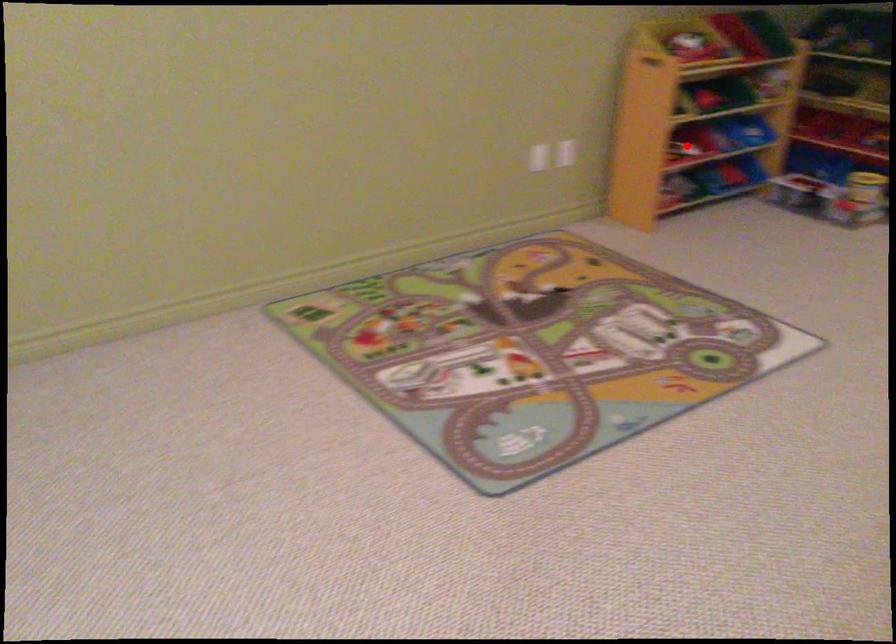
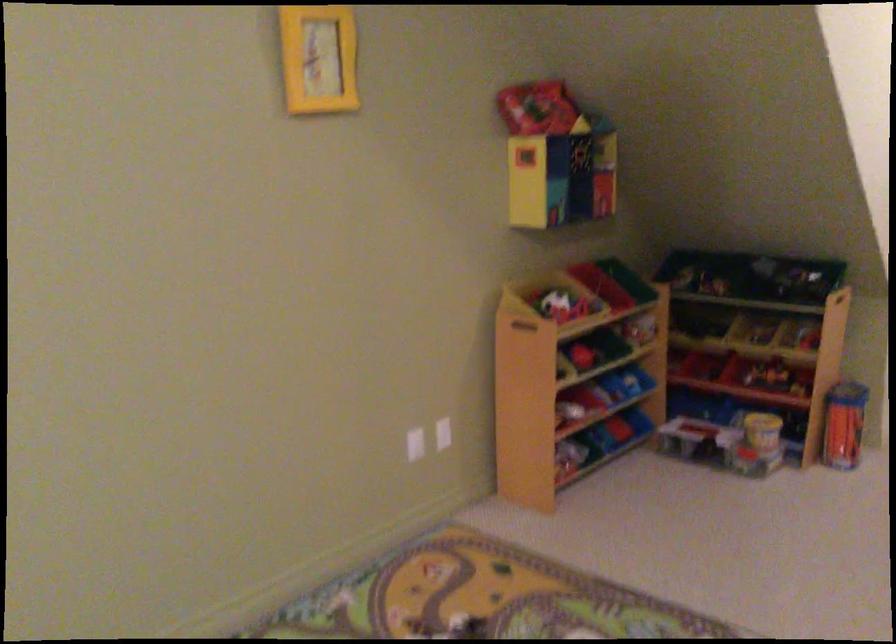
Where in the second image is the point corresponding to the highlighted location from the first image?

(571, 410)